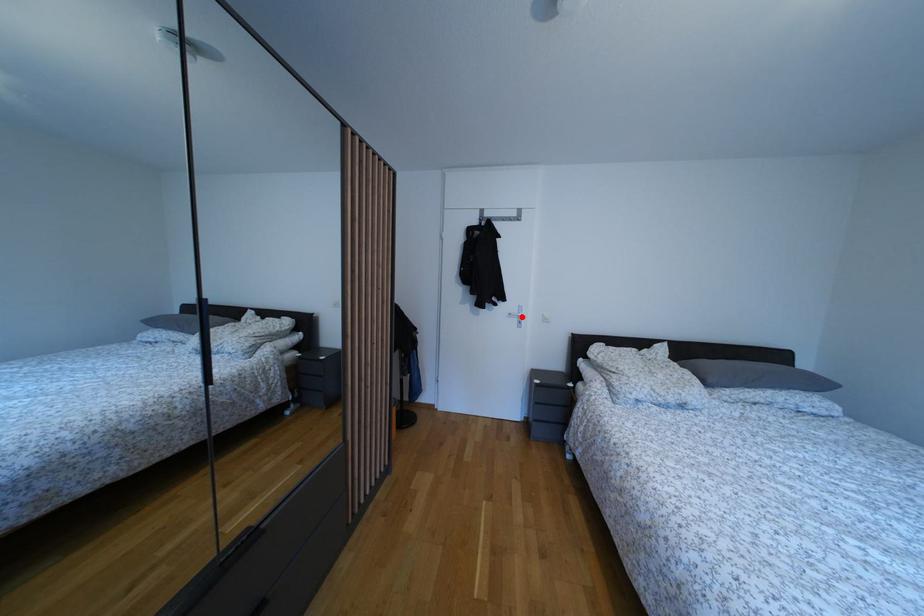
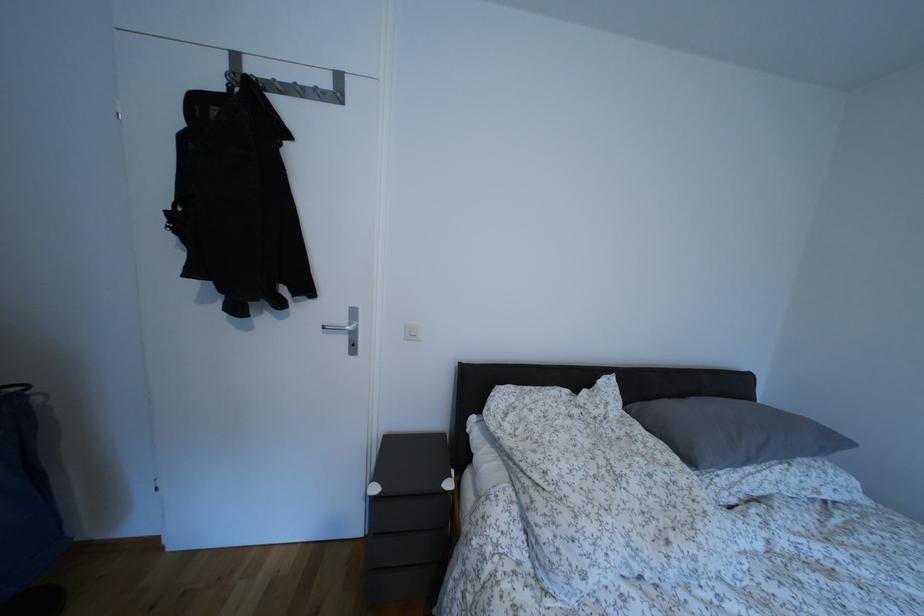
Question: I am providing you with two images of the same scene from different viewpoints. A red point is marked on the first image. At the location where the point appears in image 1, is it still visible in image 2?

Choices:
 (A) Yes
 (B) No

Answer: (A)